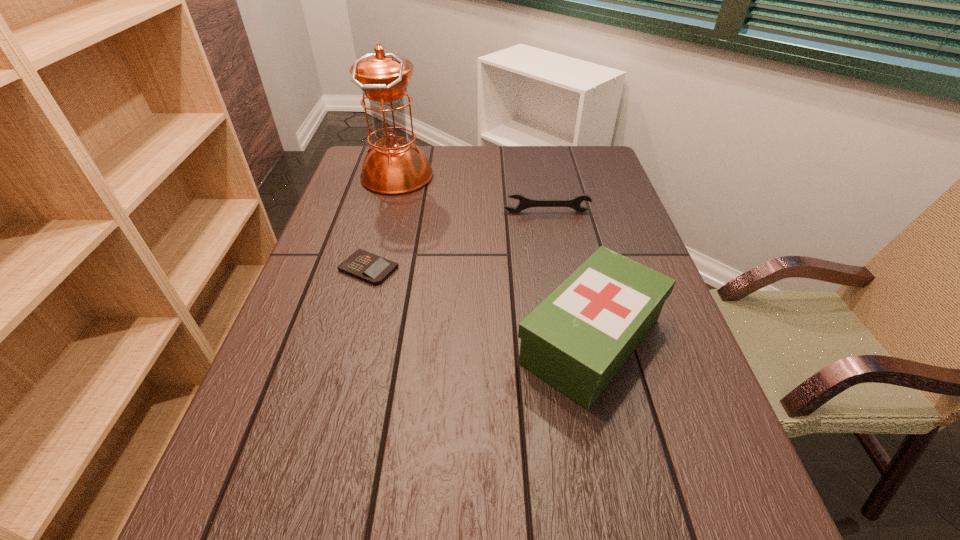
Image resolution: width=960 pixels, height=540 pixels. In order to click on free space at the far right corner in this screenshot , I will do `click(615, 180)`.

Locate an element on the screen. This screenshot has width=960, height=540. unoccupied area between the third shortest object and the shortest object is located at coordinates (480, 305).

You are a GUI agent. You are given a task and a screenshot of the screen. Output one action in this format:
    pyautogui.click(x=<x>, y=<y>)
    Task: Click on the free point between the first-aid kit and the calculator
    The width and height of the screenshot is (960, 540).
    Given the screenshot: What is the action you would take?
    pyautogui.click(x=480, y=305)

At what (x,y) coordinates should I click in order to perform the action: click on vacant region between the shortest object and the third tallest object. Please return your answer as a coordinate pair (x, y). This screenshot has width=960, height=540. Looking at the image, I should click on (458, 240).

Locate an element on the screen. The height and width of the screenshot is (540, 960). free space between the second tallest object and the farthest object is located at coordinates (494, 259).

The width and height of the screenshot is (960, 540). Find the location of `vacant area that lies between the calculator and the tallest object`. vacant area that lies between the calculator and the tallest object is located at coordinates point(383,222).

I want to click on free space between the third nearest object and the farthest object, so click(x=472, y=194).

Where is `free space between the wrench and the tallest object`? This screenshot has height=540, width=960. free space between the wrench and the tallest object is located at coordinates (472, 194).

Identify the location of empty space that is in between the tallest object and the shortest object. (383, 222).

Identify the location of vacant space that is in between the calculator and the first-aid kit. The image size is (960, 540). (480, 305).